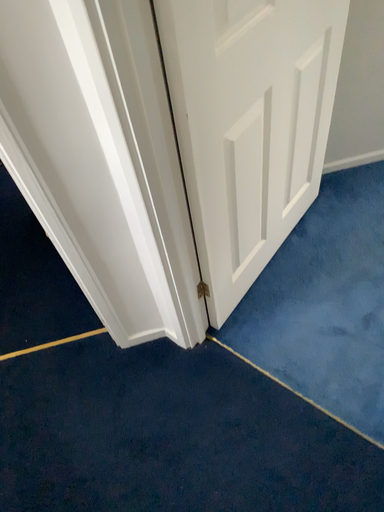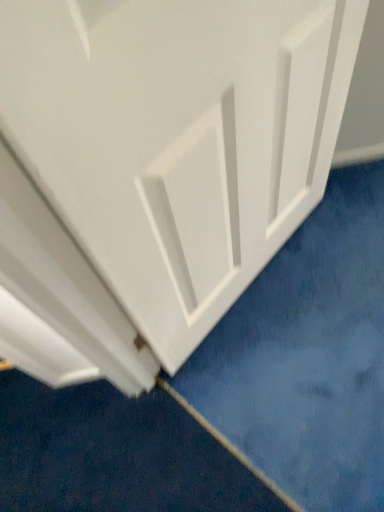
Question: Which way did the camera rotate in the video?

Choices:
 (A) rotated upward
 (B) rotated downward

Answer: (B)